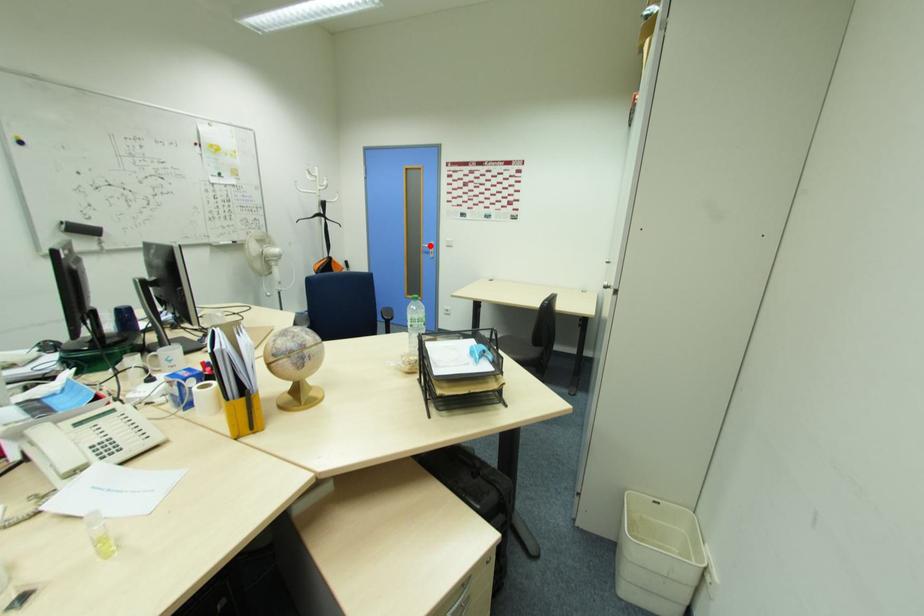
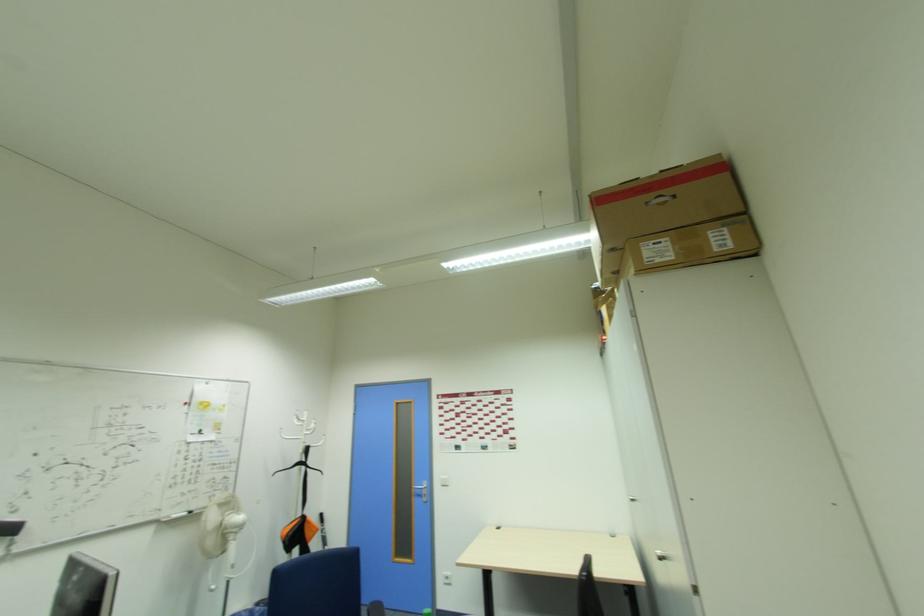
Where in the second image is the point corresponding to the highlighted location from the first image?

(421, 485)